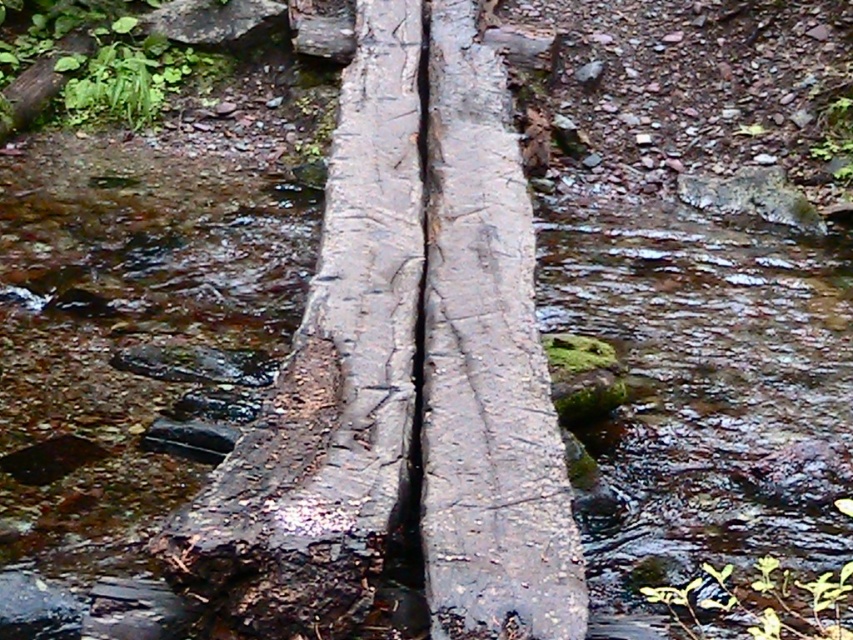
Question: Can you confirm if wet wood log at center is wider than rough bark log at center?

Choices:
 (A) no
 (B) yes

Answer: (B)

Question: Which of these objects is positioned closest to the smooth bark log at center?

Choices:
 (A) rough bark log at center
 (B) wet wood log at center

Answer: (A)

Question: Does wet wood log at center have a larger size compared to smooth bark log at center?

Choices:
 (A) no
 (B) yes

Answer: (B)

Question: Considering the real-world distances, which object is farthest from the rough bark log at center?

Choices:
 (A) wet wood log at center
 (B) smooth bark log at center

Answer: (A)

Question: Is rough bark log at center further to the viewer compared to smooth bark log at center?

Choices:
 (A) yes
 (B) no

Answer: (B)

Question: Which of the following is the farthest from the observer?

Choices:
 (A) rough bark log at center
 (B) smooth bark log at center
 (C) wet wood log at center

Answer: (C)